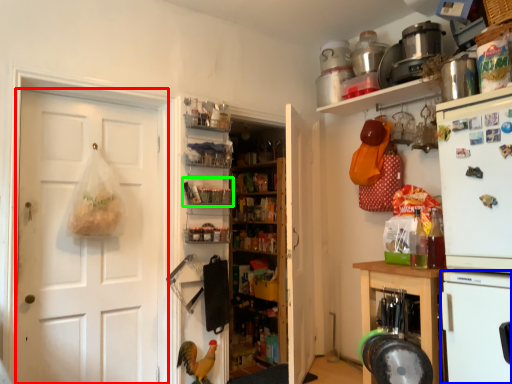
Question: Which object is the farthest from door (highlighted by a red box)? Choose among these: appliance (highlighted by a blue box) or shelf (highlighted by a green box).

Choices:
 (A) appliance
 (B) shelf

Answer: (A)